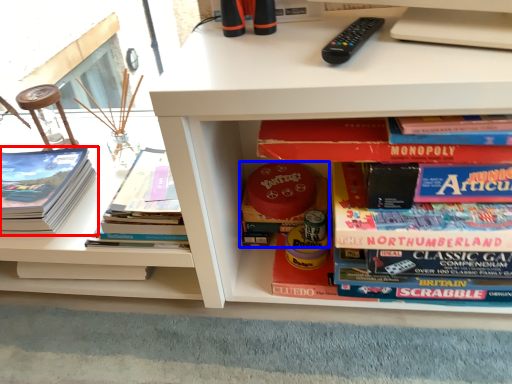
Question: Which object is further to the camera taking this photo, book (highlighted by a red box) or book (highlighted by a blue box)?

Choices:
 (A) book
 (B) book

Answer: (B)